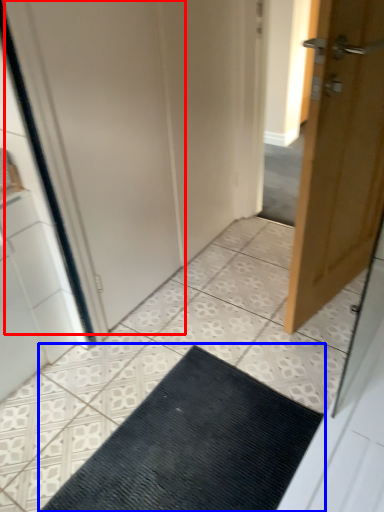
Question: Which of the following is the closest to the observer, screen door (highlighted by a red box) or doormat (highlighted by a blue box)?

Choices:
 (A) screen door
 (B) doormat

Answer: (B)